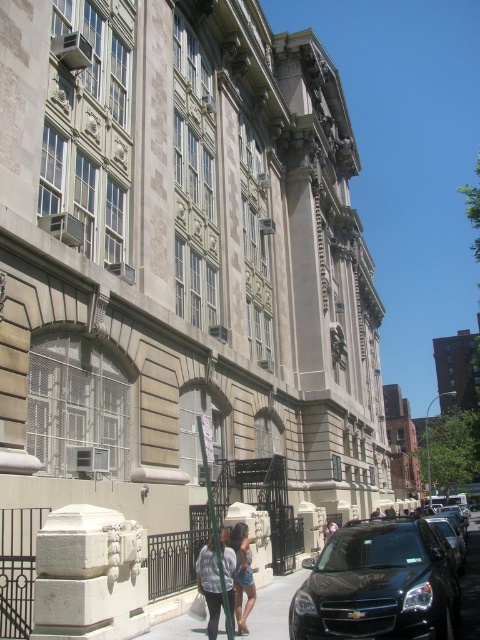
Question: Estimate the real-world distances between objects in this image. Which object is closer to the black glossy car at lower right?

Choices:
 (A) black matte car at lower right
 (B) denim jacket at lower center
 (C) smooth concrete pavement at center
 (D) denim shorts at lower center

Answer: (C)

Question: Is smooth concrete pavement at center smaller than denim shorts at lower center?

Choices:
 (A) yes
 (B) no

Answer: (B)

Question: Which point appears closest to the camera in this image?

Choices:
 (A) (417, 627)
 (B) (239, 588)
 (C) (243, 616)

Answer: (A)

Question: Which object appears closest to the camera in this image?

Choices:
 (A) smooth concrete pavement at center
 (B) denim shorts at lower center

Answer: (A)

Question: Is the position of black matte car at lower right more distant than that of black glossy car at lower right?

Choices:
 (A) yes
 (B) no

Answer: (B)

Question: Can you confirm if smooth concrete pavement at center is thinner than denim jacket at lower center?

Choices:
 (A) yes
 (B) no

Answer: (B)